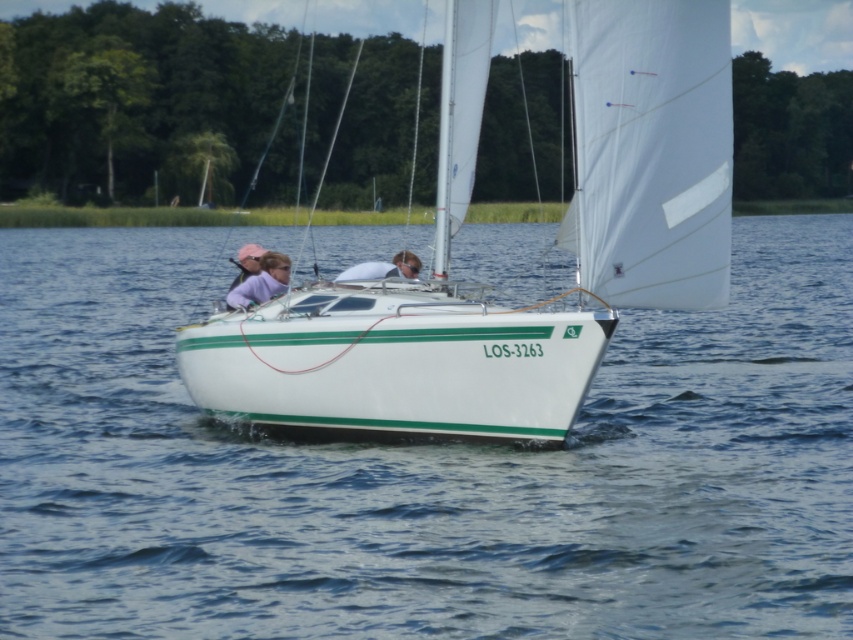
Question: Which of these objects is positioned closest to the clear blue water at center?

Choices:
 (A) white glossy sailboat at center
 (B) matte white shirt at center
 (C) matte purple shirt at center

Answer: (B)

Question: Which of the following is the closest to the observer?

Choices:
 (A) (347, 276)
 (B) (463, 604)
 (C) (448, 426)
 (D) (270, 268)

Answer: (B)

Question: Is the position of clear blue water at center more distant than that of matte purple shirt at center?

Choices:
 (A) no
 (B) yes

Answer: (A)

Question: Is clear blue water at center to the right of white glossy sailboat at center from the viewer's perspective?

Choices:
 (A) no
 (B) yes

Answer: (A)

Question: Which point appears closest to the camera in this image?

Choices:
 (A) (401, 262)
 (B) (477, 54)
 (C) (146, 390)
 (D) (277, 289)

Answer: (B)

Question: Is clear blue water at center to the right of matte purple shirt at center from the viewer's perspective?

Choices:
 (A) no
 (B) yes

Answer: (B)